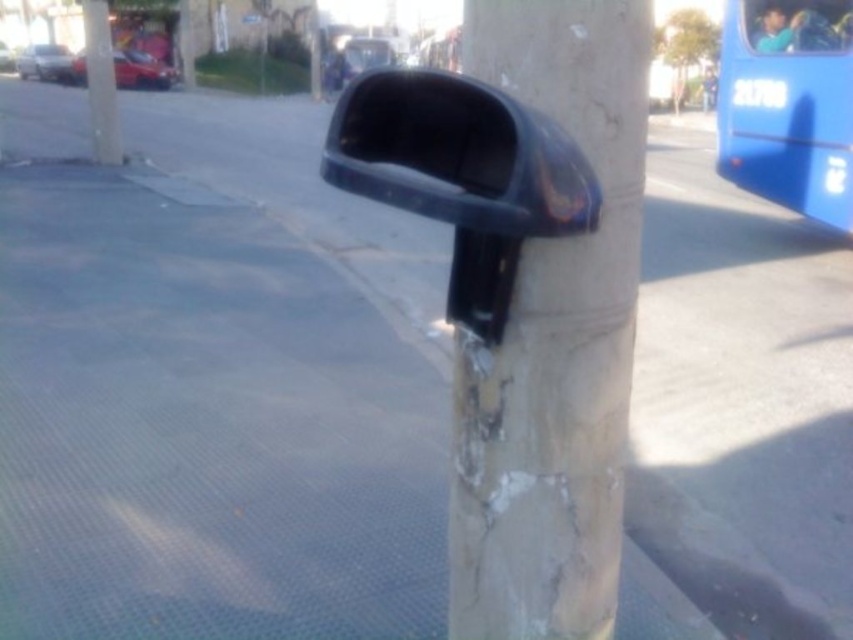
Between point (575, 589) and point (109, 106), which one is positioned behind?

The point (109, 106) is more distant.

Is marbled stone pole at center above smooth concrete pole at upper center?

No.

Describe the element at coordinates (553, 340) in the screenshot. I see `marbled stone pole at center` at that location.

Identify the location of marbled stone pole at center. (553, 340).

The width and height of the screenshot is (853, 640). Describe the element at coordinates (553, 340) in the screenshot. I see `marbled stone pole at center` at that location.

Who is positioned more to the left, marbled stone pole at center or blue matte bus at upper right?

marbled stone pole at center is more to the left.

Does point (526, 436) come in front of point (757, 147)?

Yes, it is.

The width and height of the screenshot is (853, 640). Find the location of `marbled stone pole at center`. marbled stone pole at center is located at coordinates (553, 340).

Is black plastic view mirror at center wider than blue matte bus at upper right?

No, black plastic view mirror at center is not wider than blue matte bus at upper right.

Is black plastic view mirror at center positioned behind blue matte bus at upper right?

No, black plastic view mirror at center is closer to the viewer.

The image size is (853, 640). What do you see at coordinates (457, 154) in the screenshot?
I see `black plastic view mirror at center` at bounding box center [457, 154].

Where is `black plastic view mirror at center`? The image size is (853, 640). black plastic view mirror at center is located at coordinates (457, 154).